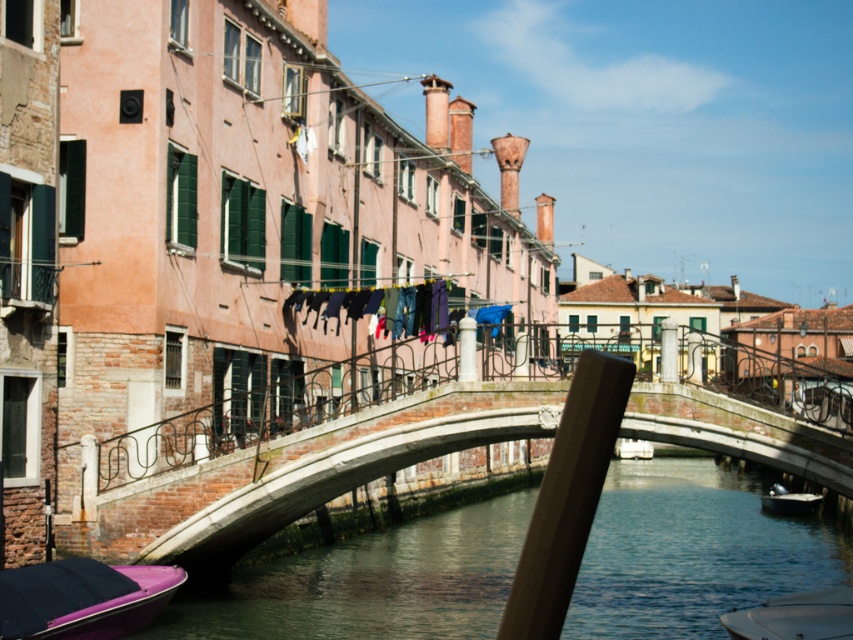
You are standing on the curved stone bridge and want to reach both the point at coordinates point (589, 573) and point (432, 445). Which point will you reach first as you walk forward?

You will reach point (589, 573) first because it is closer to you than point (432, 445), which is further away.

In the scene shown: You are standing on the curved stone bridge in the canal scene. You notice two points marked in the image. Which point, point (798, 604) or point (767, 500), is closer to you as you stand on the bridge?

Point (798, 604) is closer to the viewer than point (767, 500).